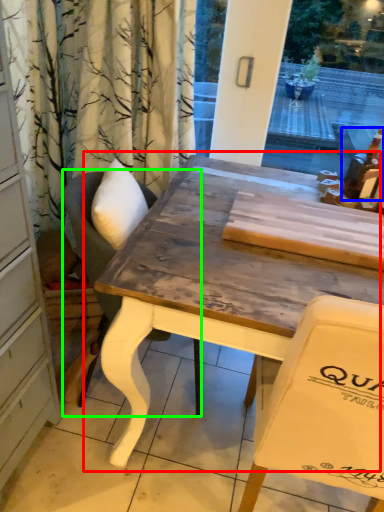
Question: Which object is the farthest from table (highlighted by a red box)? Choose among these: alcohol (highlighted by a blue box) or chair (highlighted by a green box).

Choices:
 (A) alcohol
 (B) chair

Answer: (A)